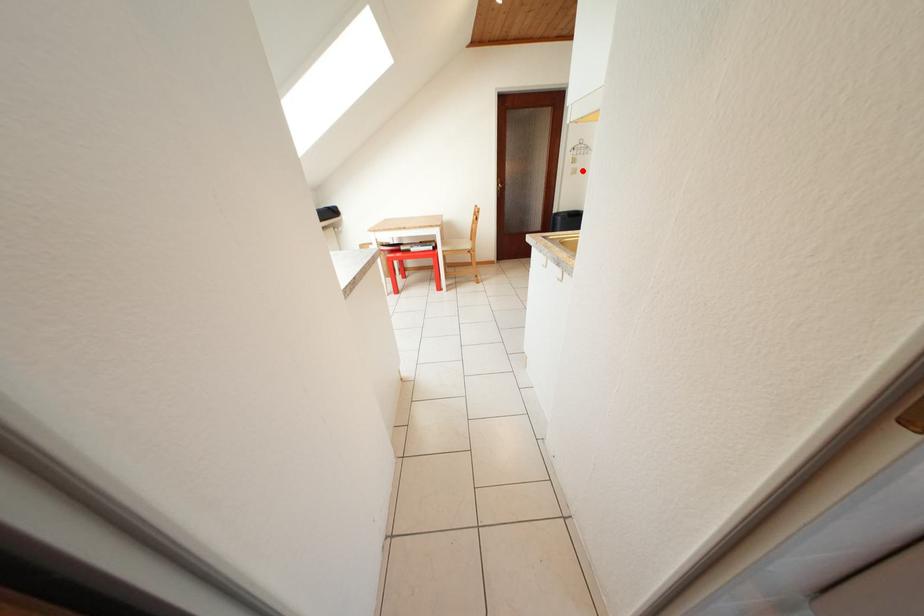
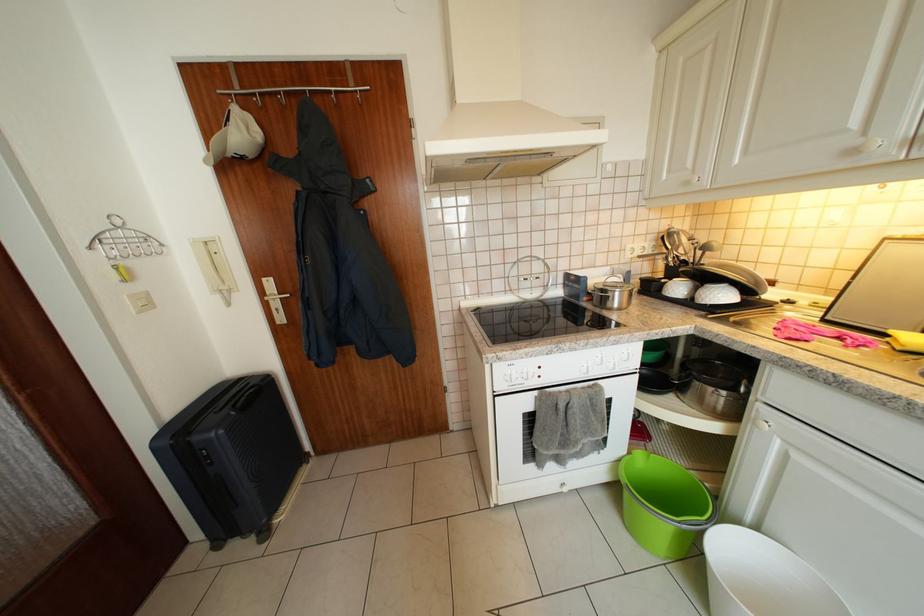
Where in the second image is the point corresponding to the highlighted location from the first image?

(144, 293)